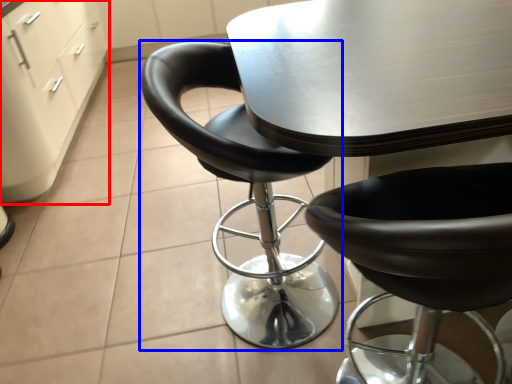
Question: Which point is further to the camera, file cabinet (highlighted by a red box) or chair (highlighted by a blue box)?

Choices:
 (A) file cabinet
 (B) chair

Answer: (A)